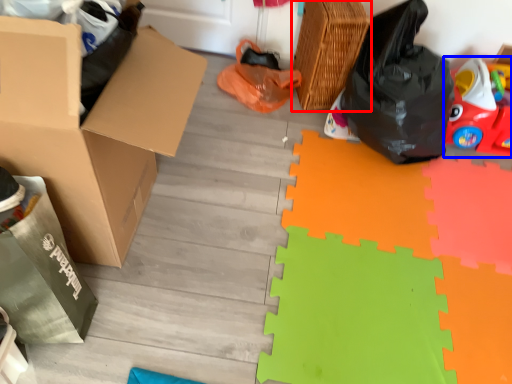
Question: Which of the following is the closest to the observer, basket (highlighted by a red box) or toy (highlighted by a blue box)?

Choices:
 (A) basket
 (B) toy

Answer: (A)